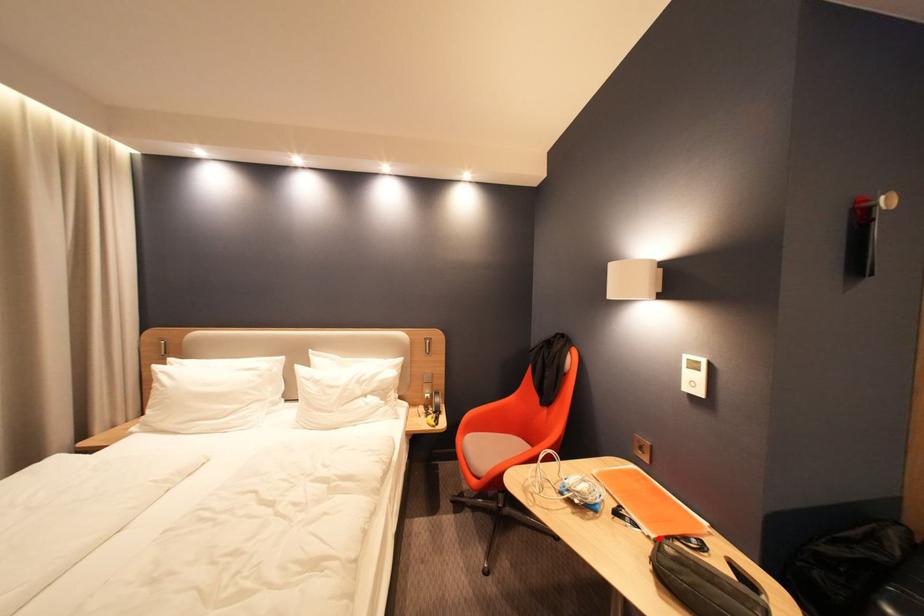
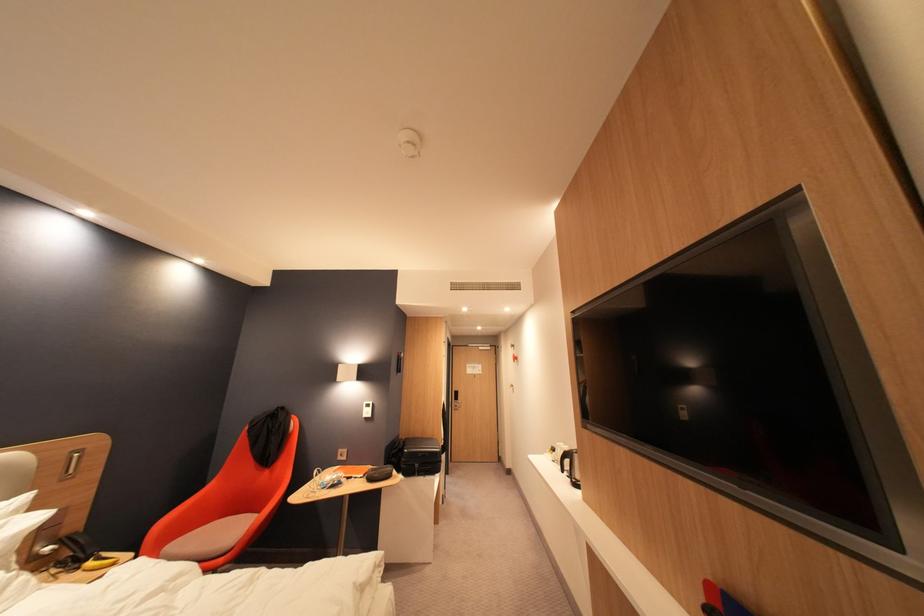
Where in the second image is the point corresponding to the highlighted location from the first image?

(371, 477)